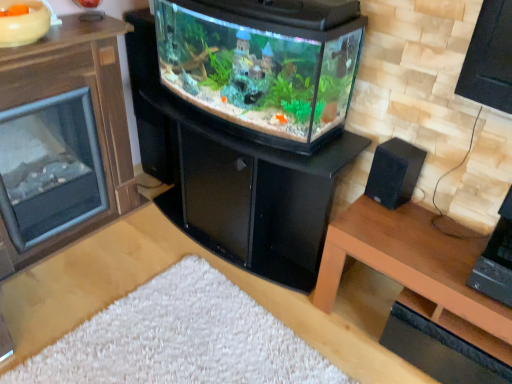
Locate an element on the screen. The height and width of the screenshot is (384, 512). free space in front of brown wood fireplace at left is located at coordinates (64, 309).